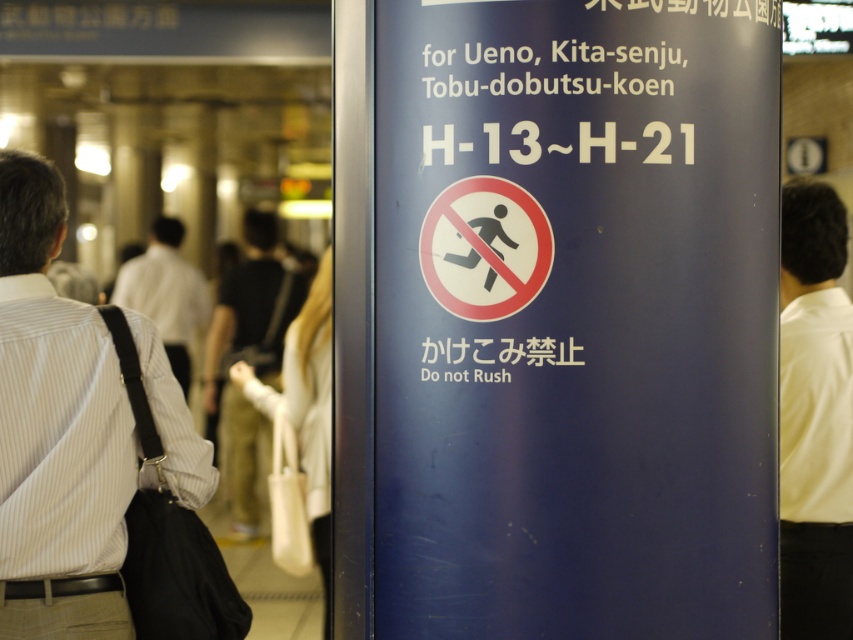
Who is more forward, (68, 371) or (175, 284)?

Point (68, 371) is more forward.

Who is positioned more to the left, white striped shirt at left or white shirt at left?

Positioned to the left is white shirt at left.

Where is `white striped shirt at left`? white striped shirt at left is located at coordinates (56, 432).

The width and height of the screenshot is (853, 640). Describe the element at coordinates (56, 432) in the screenshot. I see `white striped shirt at left` at that location.

Is point (13, 554) positioned before point (235, 352)?

Yes, point (13, 554) is in front of point (235, 352).

In order to click on white striped shirt at left in this screenshot , I will do (56, 432).

Is point (53, 547) positioned before point (845, 476)?

That is True.

How far apart are white striped shirt at left and white shirt at right?

white striped shirt at left and white shirt at right are 7.96 feet apart from each other.

This screenshot has height=640, width=853. Identify the location of white striped shirt at left. (56, 432).

The height and width of the screenshot is (640, 853). What are the coordinates of `white striped shirt at left` in the screenshot? It's located at (56, 432).